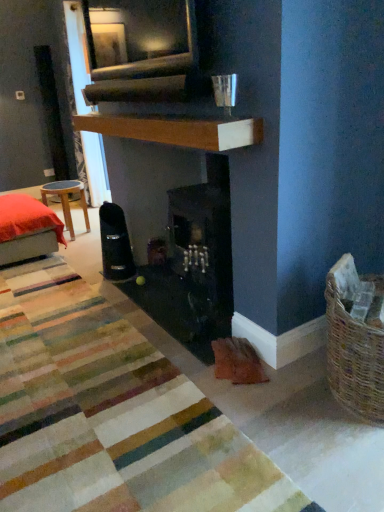
Looking at this image, measure the distance between point (x=6, y=258) and camera.

11.22 feet.

In order to face velvet red cushion at left, should I rotate leftwards or rightwards?

Turn left approximately 22.226 degrees to face it.

You are a GUI agent. You are given a task and a screenshot of the screen. Output one action in this format:
    pyautogui.click(x=<x>, y=<y>)
    Task: Click on the wooden mantle at upper center
    
    Given the screenshot: What is the action you would take?
    pyautogui.click(x=176, y=130)

The height and width of the screenshot is (512, 384). Identify the location of wooden stool at left. (67, 200).

What do you see at coordinates (112, 414) in the screenshot? I see `striped wool rug at center` at bounding box center [112, 414].

Locate an element on the screen. white textured curtain at upper left is located at coordinates (77, 53).

There is a striped wool rug at center. Identify the location of curtain above it (from a real-world perspective). (77, 53).

Is white textured curtain at upper left bigger than striped wool rug at center?

No.

Is white textured curtain at upper left thinner than striped wool rug at center?

Yes, white textured curtain at upper left is thinner than striped wool rug at center.

Is white textured curtain at upper left positioned behind striped wool rug at center?

That is True.

Between wooden stool at left and white textured curtain at upper left, which one has smaller width?

white textured curtain at upper left.

The image size is (384, 512). What are the coordinates of `curtain above the wooden stool at left (from a real-world perspective)` in the screenshot? It's located at (77, 53).

Is wooden stool at left directly adjacent to white textured curtain at upper left?

wooden stool at left is not next to white textured curtain at upper left, and they're not touching.

Is wooden mantle at upper center inside striped wool rug at center?

No, wooden mantle at upper center is located outside of striped wool rug at center.

Are striped wool rug at center and wooden mantle at upper center making contact?

They are not placed beside each other.

Based on the photo, from the image's perspective, relative to wooden mantle at upper center, is striped wool rug at center above or below?

striped wool rug at center is below wooden mantle at upper center.

Considering the relative positions of wooden mantle at upper center and white textured curtain at upper left in the image provided, is wooden mantle at upper center to the left or to the right of white textured curtain at upper left?

Clearly, wooden mantle at upper center is on the right of white textured curtain at upper left in the image.

Is point (251, 127) farther from viewer compared to point (74, 47)?

No.

Is wooden mantle at upper center far from white textured curtain at upper left?

Yes, wooden mantle at upper center is far from white textured curtain at upper left.

Locate an element on the screen. This screenshot has height=512, width=384. mantle below the white textured curtain at upper left (from a real-world perspective) is located at coordinates (176, 130).

Can you tell me how much velvet red cushion at left and striped wool rug at center differ in facing direction?

The angular difference between velvet red cushion at left and striped wool rug at center is 1.08 degrees.

Can you confirm if velvet red cushion at left is shorter than striped wool rug at center?

In fact, velvet red cushion at left may be taller than striped wool rug at center.

From a real-world perspective, is velvet red cushion at left on striped wool rug at center?

Correct, in the physical world, velvet red cushion at left is higher than striped wool rug at center.

Considering their positions, is velvet red cushion at left located in front of or behind striped wool rug at center?

In the image, velvet red cushion at left appears behind striped wool rug at center.

The height and width of the screenshot is (512, 384). I want to click on mantle above the striped wool rug at center (from the image's perspective), so click(176, 130).

Is wooden mantle at upper center far away from striped wool rug at center?

Yes, wooden mantle at upper center and striped wool rug at center are located far from each other.

Is wooden mantle at upper center aimed at striped wool rug at center?

No, wooden mantle at upper center does not turn towards striped wool rug at center.

Is wooden mantle at upper center inside or outside of striped wool rug at center?

The correct answer is: outside.

Between wooden stool at left and wooden mantle at upper center, which one appears on the right side from the viewer's perspective?

From the viewer's perspective, wooden mantle at upper center appears more on the right side.

Which object is further away from the camera taking this photo, wooden stool at left or wooden mantle at upper center?

wooden stool at left.

Is wooden stool at left not within wooden mantle at upper center?

Yes, wooden stool at left is outside of wooden mantle at upper center.

Identify the location of table behind the wooden mantle at upper center. (67, 200).

Where is `curtain behind the striped wool rug at center`? The width and height of the screenshot is (384, 512). curtain behind the striped wool rug at center is located at coordinates (77, 53).

You are a GUI agent. You are given a task and a screenshot of the screen. Output one action in this format:
    pyautogui.click(x=<x>, y=<y>)
    Task: Click on the table in front of the white textured curtain at upper left
    The width and height of the screenshot is (384, 512).
    Given the screenshot: What is the action you would take?
    pyautogui.click(x=67, y=200)

From the image, which object appears to be farther from velvet red cushion at left, wooden stool at left or wooden mantle at upper center?

Based on the image, wooden mantle at upper center appears to be further to velvet red cushion at left.

From the image, which object appears to be nearer to striped wool rug at center, velvet red cushion at left or wooden stool at left?

Among the two, velvet red cushion at left is located nearer to striped wool rug at center.

Estimate the real-world distances between objects in this image. Which object is closer to velvet red cushion at left, striped wool rug at center or wooden stool at left?

Among the two, wooden stool at left is located nearer to velvet red cushion at left.

Considering their positions, is wooden stool at left positioned closer to white textured curtain at upper left than wooden mantle at upper center?

wooden stool at left is positioned closer to the anchor white textured curtain at upper left.

Considering their positions, is wooden mantle at upper center positioned further to wooden stool at left than white textured curtain at upper left?

Among the two, wooden mantle at upper center is located further to wooden stool at left.

From the picture: From the image, which object appears to be nearer to velvet red cushion at left, wooden stool at left or striped wool rug at center?

Among the two, wooden stool at left is located nearer to velvet red cushion at left.

Estimate the real-world distances between objects in this image. Which object is closer to white textured curtain at upper left, striped wool rug at center or velvet red cushion at left?

The object closer to white textured curtain at upper left is velvet red cushion at left.

From the image, which object appears to be farther from striped wool rug at center, wooden stool at left or wooden mantle at upper center?

wooden stool at left.

At what (x,y) coordinates should I click in order to perform the action: click on furniture located between striped wool rug at center and wooden stool at left in the depth direction. Please return your answer as a coordinate pair (x, y). The height and width of the screenshot is (512, 384). Looking at the image, I should click on (27, 229).

At what (x,y) coordinates should I click in order to perform the action: click on furniture positioned between striped wool rug at center and white textured curtain at upper left from near to far. Please return your answer as a coordinate pair (x, y). Looking at the image, I should click on (27, 229).

I want to click on table between wooden mantle at upper center and white textured curtain at upper left along the z-axis, so click(x=67, y=200).

At what (x,y) coordinates should I click in order to perform the action: click on furniture located between wooden mantle at upper center and wooden stool at left in the depth direction. Please return your answer as a coordinate pair (x, y). Looking at the image, I should click on (27, 229).